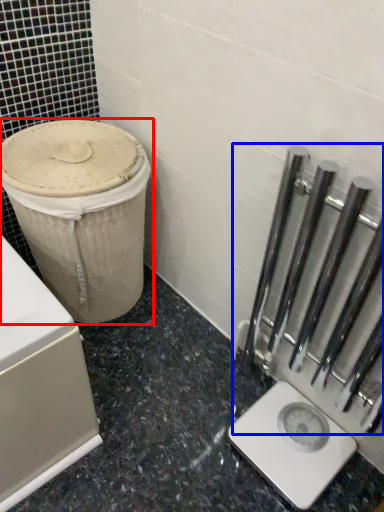
Question: Which object is closer to the camera taking this photo, waste container (highlighted by a red box) or rail (highlighted by a blue box)?

Choices:
 (A) waste container
 (B) rail

Answer: (B)